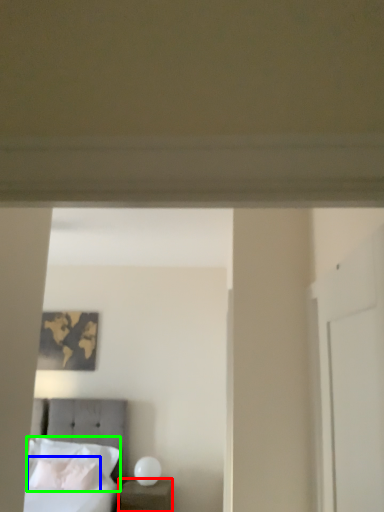
Question: Which object is the closest to the nightstand (highlighted by a red box)? Choose among these: pillow (highlighted by a blue box) or pillow (highlighted by a green box).

Choices:
 (A) pillow
 (B) pillow

Answer: (A)